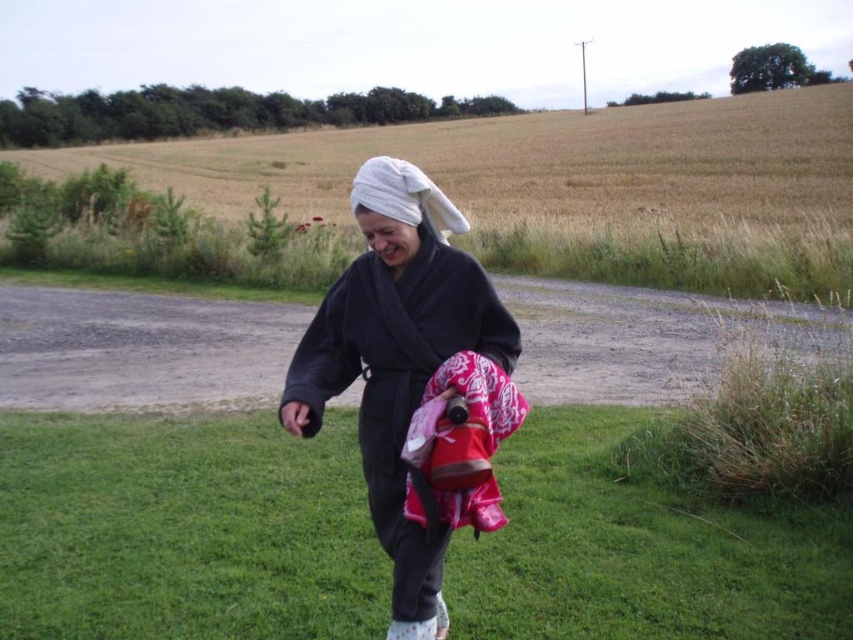
Question: Among these objects, which one is nearest to the camera?

Choices:
 (A) brown grassland at center
 (B) white towel at center

Answer: (B)

Question: From the image, what is the correct spatial relationship of dark gray bathrobe at center in relation to white towel at center?

Choices:
 (A) right
 (B) left

Answer: (A)

Question: Considering the real-world distances, which object is closest to the brown grassland at center?

Choices:
 (A) dark gray bathrobe at center
 (B) white towel at center
 (C) green grass at lower center

Answer: (C)

Question: Is dark gray bathrobe at center smaller than white towel at center?

Choices:
 (A) no
 (B) yes

Answer: (B)

Question: Estimate the real-world distances between objects in this image. Which object is farther from the dark gray bathrobe at center?

Choices:
 (A) brown grassland at center
 (B) green grass at lower center
 (C) white towel at center

Answer: (A)

Question: Can you confirm if green grass at lower center is positioned above dark gray bathrobe at center?

Choices:
 (A) yes
 (B) no

Answer: (B)